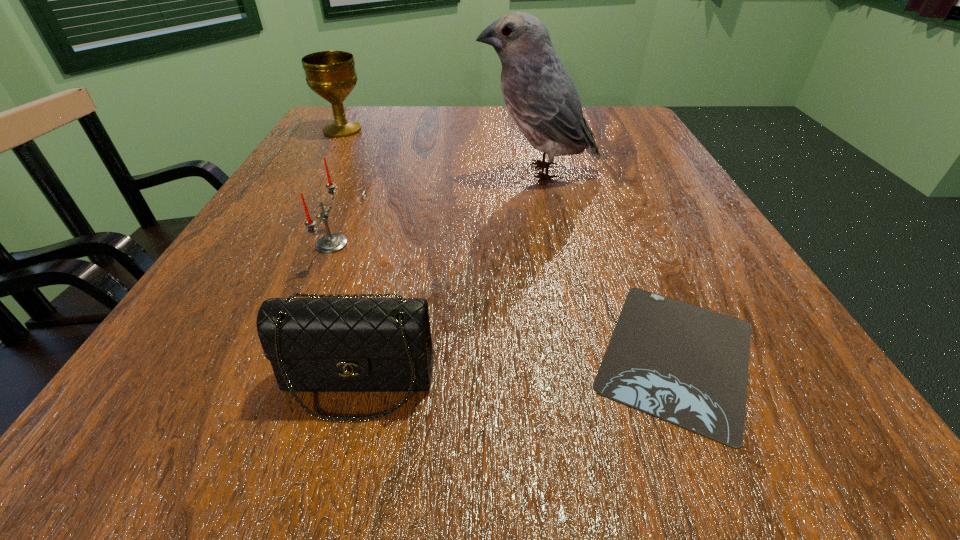
This screenshot has height=540, width=960. I want to click on free area in between the fourth nearest object and the mousepad, so click(x=608, y=264).

Image resolution: width=960 pixels, height=540 pixels. Find the location of `vacant area that lies between the third nearest object and the farthest object`. vacant area that lies between the third nearest object and the farthest object is located at coordinates (337, 187).

Where is `vacant point located between the farthest object and the clutch bag`? The height and width of the screenshot is (540, 960). vacant point located between the farthest object and the clutch bag is located at coordinates (350, 256).

At what (x,y) coordinates should I click in order to perform the action: click on free spot between the candle and the shortest object. Please return your answer as a coordinate pair (x, y). The height and width of the screenshot is (540, 960). Looking at the image, I should click on (505, 300).

I want to click on free space that is in between the second tallest object and the second shortest object, so click(x=350, y=256).

This screenshot has height=540, width=960. Find the location of `vacant point located between the mousepad and the tallest object`. vacant point located between the mousepad and the tallest object is located at coordinates (608, 264).

Where is `the second closest object to the third farthest object`? The width and height of the screenshot is (960, 540). the second closest object to the third farthest object is located at coordinates (540, 95).

Where is `the fourth closest object to the candle`? The height and width of the screenshot is (540, 960). the fourth closest object to the candle is located at coordinates (687, 365).

At what (x,y) coordinates should I click in order to perform the action: click on vacant point that satisfies the following two spatial constraints: 1. on the front side of the shortest object; 2. on the right side of the leftmost object. Please return your answer as a coordinate pair (x, y). Image resolution: width=960 pixels, height=540 pixels. Looking at the image, I should click on (212, 355).

At what (x,y) coordinates should I click in order to perform the action: click on vacant space that satisfies the following two spatial constraints: 1. on the front side of the leftmost object; 2. on the right side of the shortest object. Please return your answer as a coordinate pair (x, y). This screenshot has width=960, height=540. Looking at the image, I should click on [x=212, y=355].